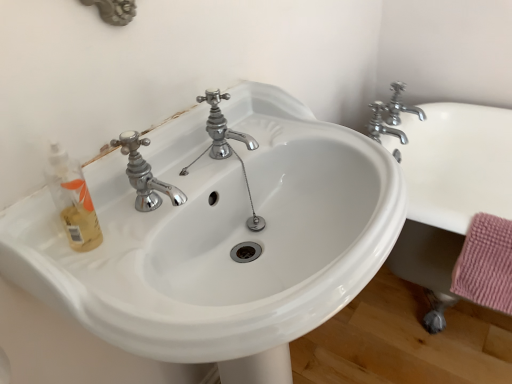
Question: From the image's perspective, is white glossy sink at center beneath chrome metallic faucet at upper right, the second tap from the right?

Choices:
 (A) yes
 (B) no

Answer: (A)

Question: Is white glossy sink at center bigger than chrome metallic faucet at upper right, the second tap from the right?

Choices:
 (A) no
 (B) yes

Answer: (B)

Question: Is white glossy sink at center to the left of chrome metallic faucet at upper right, the second tap from the right, from the viewer's perspective?

Choices:
 (A) yes
 (B) no

Answer: (A)

Question: From the image's perspective, is white glossy sink at center above chrome metallic faucet at upper right, the second tap from the right?

Choices:
 (A) yes
 (B) no

Answer: (B)

Question: Can we say white glossy sink at center lies outside chrome metallic faucet at upper right, the 1th tap viewed from the left?

Choices:
 (A) no
 (B) yes

Answer: (B)

Question: Is white glossy sink at center in contact with chrome metallic faucet at upper right, the second tap from the right?

Choices:
 (A) yes
 (B) no

Answer: (B)

Question: Is white ceramic bath at right wider than chrome metallic faucet at upper right, the second tap from the right?

Choices:
 (A) no
 (B) yes

Answer: (B)

Question: Could you tell me if white ceramic bath at right is turned towards chrome metallic faucet at upper right, the 1th tap viewed from the left?

Choices:
 (A) no
 (B) yes

Answer: (A)

Question: Is white ceramic bath at right thinner than chrome metallic faucet at upper right, the second tap from the right?

Choices:
 (A) no
 (B) yes

Answer: (A)

Question: From the image's perspective, is white ceramic bath at right located above chrome metallic faucet at upper right, the 1th tap viewed from the left?

Choices:
 (A) yes
 (B) no

Answer: (B)

Question: Is white ceramic bath at right smaller than chrome metallic faucet at upper right, the 1th tap viewed from the left?

Choices:
 (A) no
 (B) yes

Answer: (A)

Question: Are white ceramic bath at right and chrome metallic faucet at upper right, the 1th tap viewed from the left, beside each other?

Choices:
 (A) yes
 (B) no

Answer: (B)

Question: Is chrome metallic faucet at upper right, acting as the first tap starting from the right, not near white glossy sink at center?

Choices:
 (A) no
 (B) yes

Answer: (A)